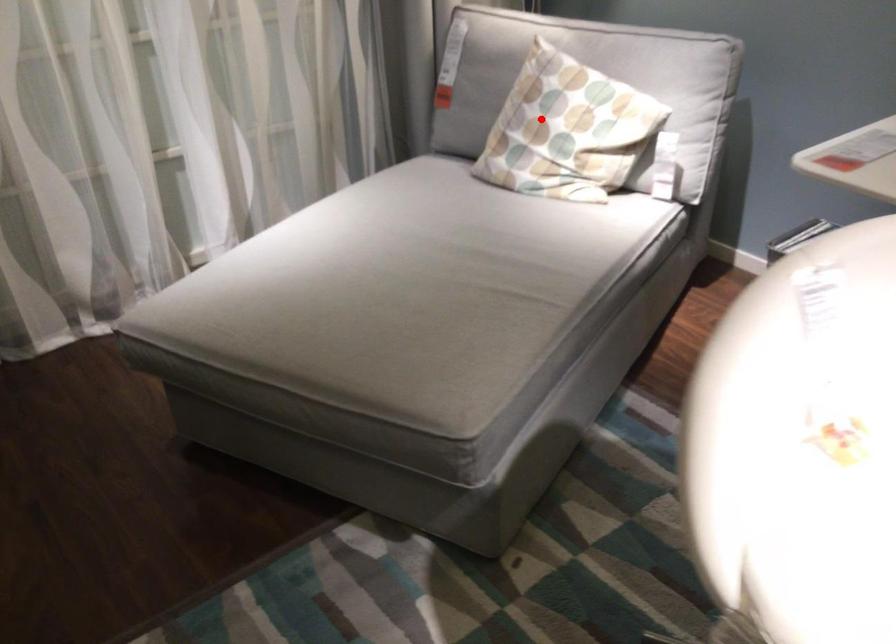
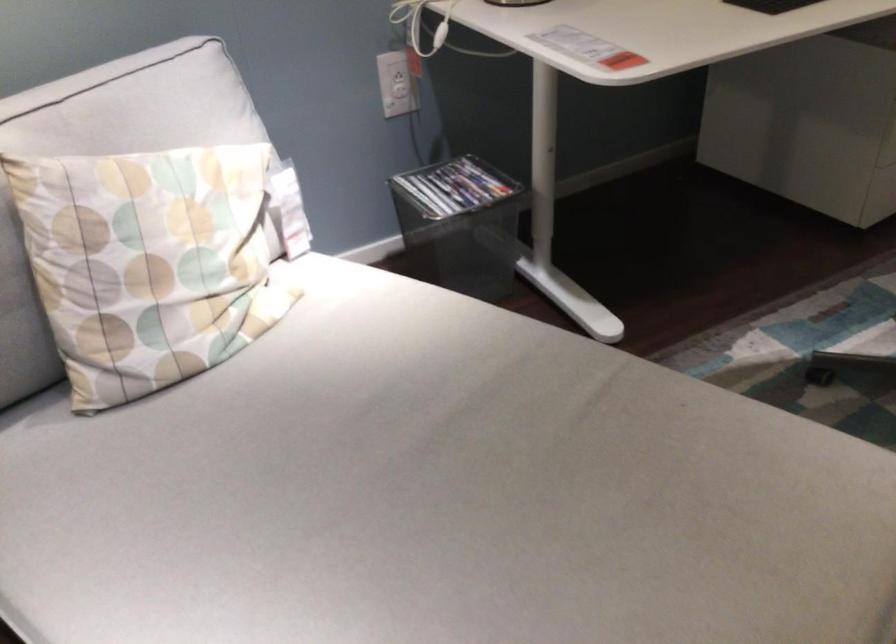
Question: I am providing you with two images of the same scene from different viewpoints. Given a red point in image1, look at the same physical point in image2. Is it:

Choices:
 (A) Closer to the viewpoint
 (B) Farther from the viewpoint

Answer: (A)